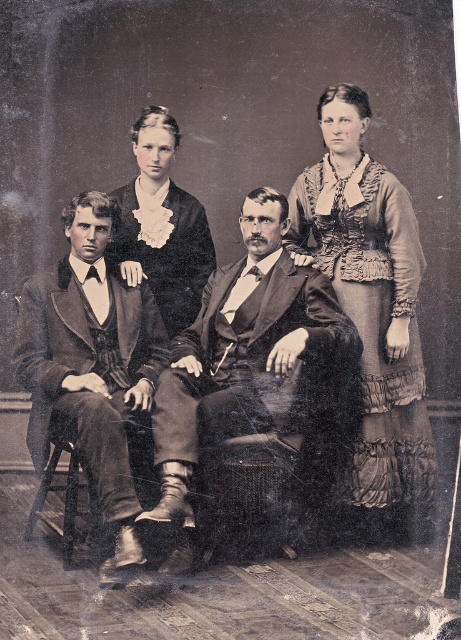
You are a tailor measuring the distance between two suits in a vintage photograph. The scene shows a formal portrait with four individuals, including the two men in the matte black suit at center and the smooth brown suit at center. You need to determine if a 3.5 inch ruler can accurately measure the space between them. Can the ruler fit between the two suits?

The matte black suit at center is 3.87 inches from the smooth brown suit at center. Since the ruler is 3.5 inches long, it can fit between them as the distance is slightly larger than the ruler.

In the vintage photograph, you notice a matte black suit at center and a ruffled fabric dress at right. Based on their positions, which object is closer to the left edge of the image?

The matte black suit at center is closer to the left edge of the image because it is positioned to the left of the ruffled fabric dress at right.